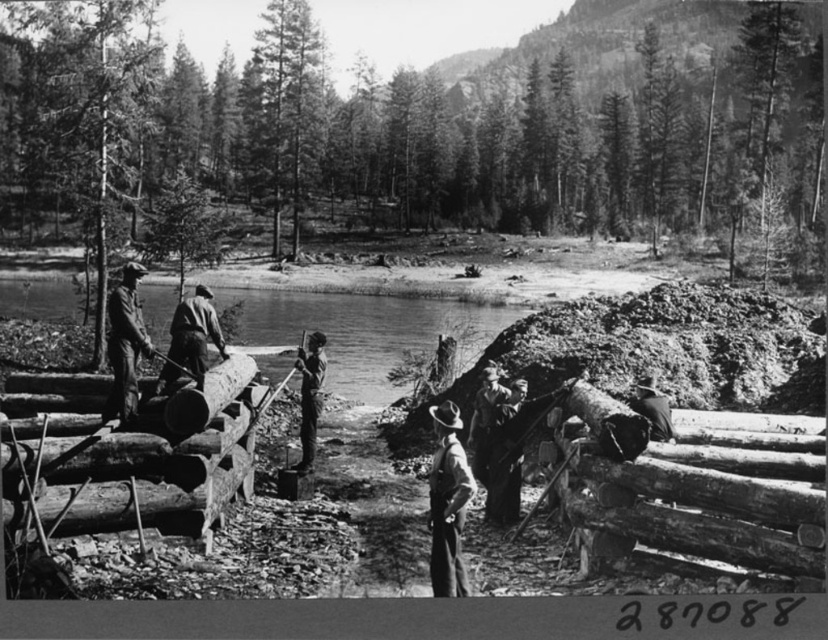
Looking at this image, how far apart are clear water at center and dark gray fabric jacket at center?

clear water at center and dark gray fabric jacket at center are 18.25 meters apart.

Is clear water at center below dark gray fabric jacket at center?

No, clear water at center is not below dark gray fabric jacket at center.

Does point (272, 330) lie behind point (210, 321)?

Yes.

Locate an element on the screen. The image size is (828, 640). clear water at center is located at coordinates (360, 330).

Does point (60, 536) come behind point (203, 369)?

No, it is not.

Measure the distance from smooth wood at center to dark gray fabric jacket at center.

3.79 feet

You are a GUI agent. You are given a task and a screenshot of the screen. Output one action in this format:
    pyautogui.click(x=<x>, y=<y>)
    Task: Click on the smooth wood at center
    The height and width of the screenshot is (640, 828).
    Given the screenshot: What is the action you would take?
    pyautogui.click(x=135, y=460)

The height and width of the screenshot is (640, 828). What are the coordinates of `smooth wood at center` in the screenshot? It's located at (135, 460).

Between smooth bark tree at center and smooth bark tree at left, which one appears on the left side from the viewer's perspective?

Positioned to the left is smooth bark tree at left.

Is point (280, 48) positioned after point (84, 0)?

Yes, it is behind point (84, 0).

Who is more distant from viewer, (x=191, y=168) or (x=95, y=99)?

The point (x=191, y=168) is behind.

Locate an element on the screen. Image resolution: width=828 pixels, height=640 pixels. smooth bark tree at center is located at coordinates (417, 131).